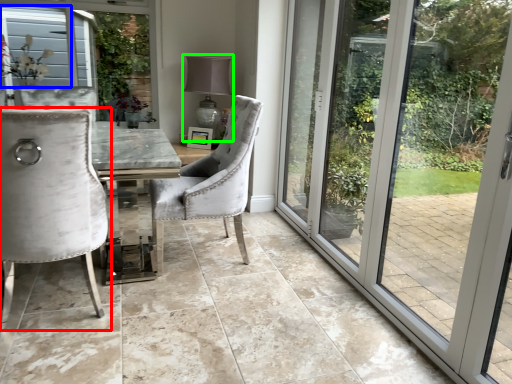
Question: Estimate the real-world distances between objects in this image. Which object is farther from chair (highlighted by a red box), window screen (highlighted by a blue box) or lamp (highlighted by a green box)?

Choices:
 (A) window screen
 (B) lamp

Answer: (A)